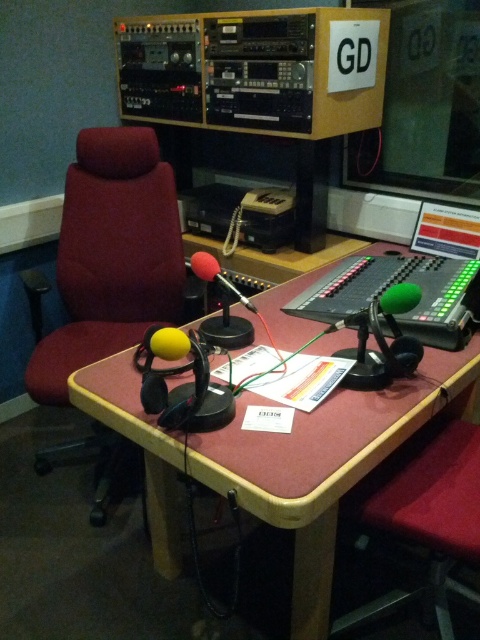
You are a guest speaker entering the studio and need to sit in the velvet red swivel chair at left. The studio is a rectangle with coordinates from 0 to 1 on both axes. The door is at the point closest to the chair. Which direction should you walk from the door to reach the chair?

The velvet red swivel chair at left is located at coordinates point (110, 256). Since the door is at the point closest to the chair, you should walk towards the chair from the door without needing to change direction, as the door is already aligned with the chair.

You are a guest speaker entering the studio and need to sit down. The velvet red swivel chair at left and the wooden desk at center are in your path. Which one should you walk around to reach the desk?

You should walk around the velvet red swivel chair at left first since it is closer to you than the wooden desk at center, so you need to navigate around it to reach the desk.

In the scene shown: You are a guest speaker preparing to sit in the velvet red swivel chair at left to give a speech. You need to reach the wooden desk at center to pick up your notes. Can you comfortably reach the desk from the chair without moving your seat?

The velvet red swivel chair at left is 30.78 inches from wooden desk at center. Since 30.78 inches is approximately 2.56 feet, which is a short distance, you can comfortably reach the wooden desk at center from the velvet red swivel chair at left without needing to move your seat.